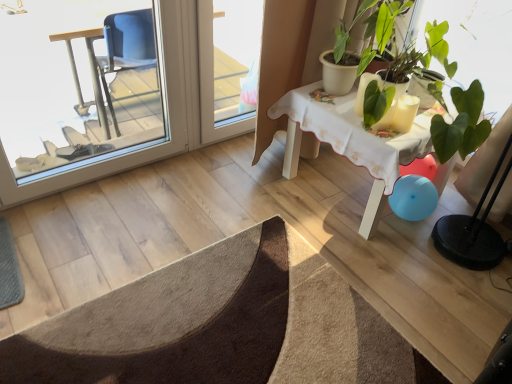
Question: Does point (16, 193) appear closer or farther from the camera than point (396, 124)?

Choices:
 (A) closer
 (B) farther

Answer: (B)

Question: From the image's perspective, is transparent glass screen door at left, placed as the second screen door when sorted from right to left, positioned above or below white glossy candle at upper right?

Choices:
 (A) above
 (B) below

Answer: (A)

Question: Based on their relative distances, which object is farther from the transparent plastic screen door at upper center, which ranks as the 2th screen door in left-to-right order?

Choices:
 (A) white wooden table at upper right
 (B) brown textured doormat at lower left
 (C) white glossy candle at upper right
 (D) transparent glass screen door at left, placed as the second screen door when sorted from right to left

Answer: (B)

Question: Which object is the closest to the transparent plastic screen door at upper center, which ranks as the 2th screen door in left-to-right order?

Choices:
 (A) transparent glass screen door at left, which is the first screen door from left to right
 (B) white wooden table at upper right
 (C) white glossy candle at upper right
 (D) brown textured doormat at lower left

Answer: (A)